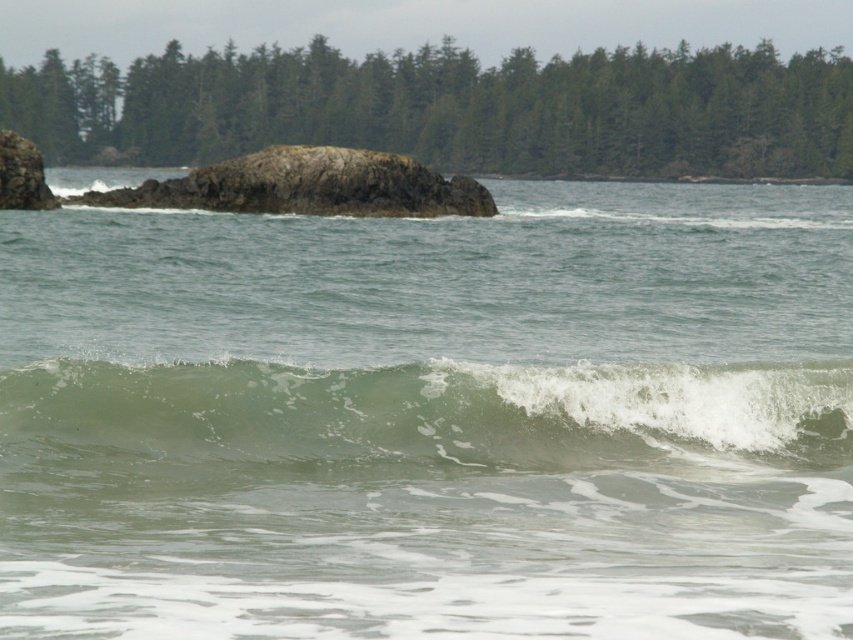
Can you confirm if green translucent water at center is thinner than rough textured rock at center?

Indeed, green translucent water at center has a lesser width compared to rough textured rock at center.

Is green translucent water at center bigger than rough textured rock at center?

No, green translucent water at center is not bigger than rough textured rock at center.

At what (x,y) coordinates should I click in order to perform the action: click on green translucent water at center. Please return your answer as a coordinate pair (x, y). The height and width of the screenshot is (640, 853). Looking at the image, I should click on (428, 417).

Which is more to the left, greenish water at wave center or green translucent water at center?

greenish water at wave center

Is point (416, 280) in front of point (4, 408)?

No, it is behind (4, 408).

Find the location of a particular element. This screenshot has width=853, height=640. greenish water at wave center is located at coordinates (431, 419).

Is greenish water at wave center to the left of rough textured rock at center from the viewer's perspective?

No, greenish water at wave center is not to the left of rough textured rock at center.

Does greenish water at wave center appear under rough textured rock at center?

Indeed, greenish water at wave center is positioned under rough textured rock at center.

What do you see at coordinates (431, 419) in the screenshot?
I see `greenish water at wave center` at bounding box center [431, 419].

Image resolution: width=853 pixels, height=640 pixels. I want to click on greenish water at wave center, so click(431, 419).